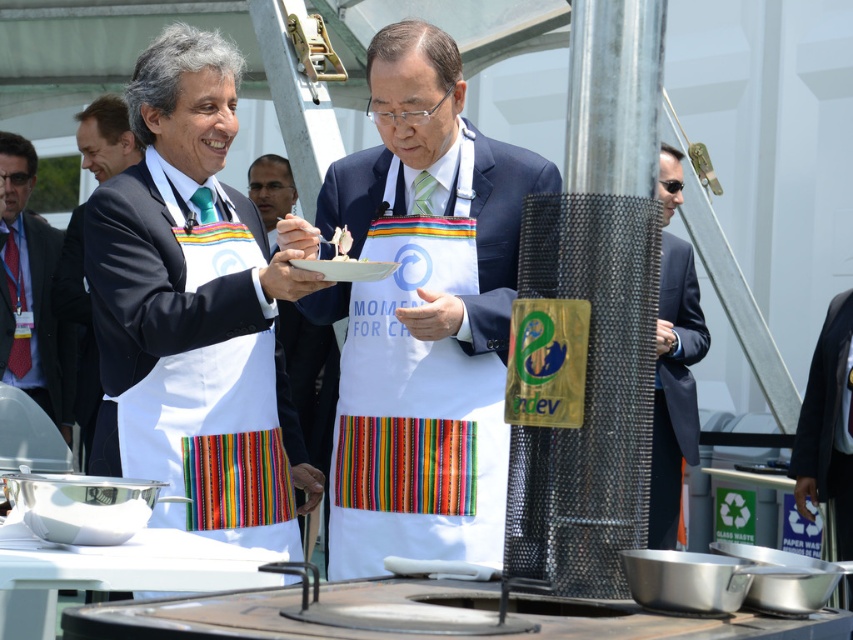
Question: Is white fabric apron at center further to the viewer compared to white matte platter at center?

Choices:
 (A) yes
 (B) no

Answer: (A)

Question: Which object is the farthest from the black suit at right?

Choices:
 (A) white matte plate at center
 (B) dark blue suit at right
 (C) white apron with colorful stripes at left
 (D) white matte platter at center

Answer: (D)

Question: Can you confirm if white fabric apron at center is wider than white matte plate at center?

Choices:
 (A) yes
 (B) no

Answer: (A)

Question: Estimate the real-world distances between objects in this image. Which object is closer to the matte white apron at center?

Choices:
 (A) white matte plate at center
 (B) white apron with colorful stripes at center
 (C) dark blue suit at right

Answer: (C)

Question: Among these objects, which one is nearest to the camera?

Choices:
 (A) white apron with colorful stripes at left
 (B) dark blue suit at right
 (C) white apron with colorful stripes at center

Answer: (A)

Question: Where is white fabric apron at center located in relation to black suit at right in the image?

Choices:
 (A) right
 (B) left

Answer: (B)